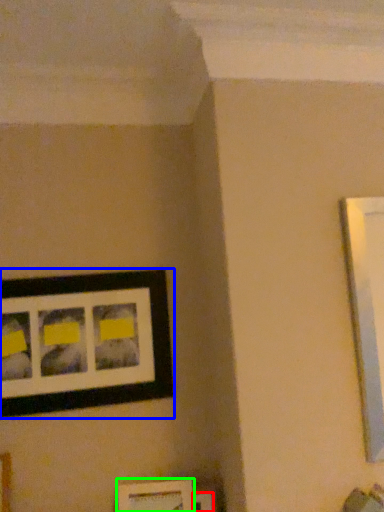
Question: Which object is positioned closest to picture frame (highlighted by a red box)? Select from picture frame (highlighted by a blue box) and picture frame (highlighted by a green box).

Choices:
 (A) picture frame
 (B) picture frame

Answer: (B)